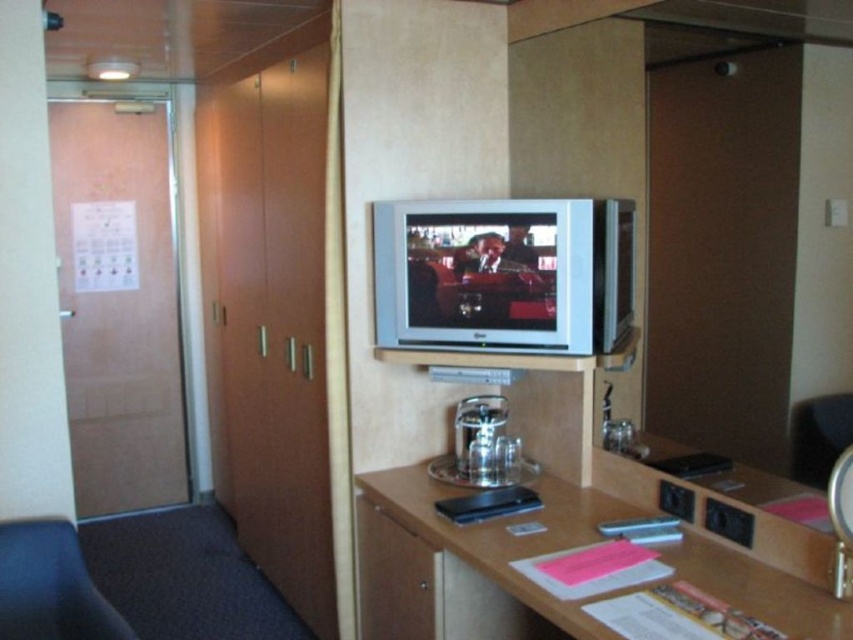
Question: Does silver metallic flat screen tv at center appear on the right side of black leather swivel chair at lower left?

Choices:
 (A) no
 (B) yes

Answer: (B)

Question: Among these objects, which one is farthest from the camera?

Choices:
 (A) matte wood drawer at center
 (B) black leather swivel chair at lower left

Answer: (A)

Question: Can you confirm if wooden desk at center is bigger than black leather swivel chair at lower left?

Choices:
 (A) no
 (B) yes

Answer: (B)

Question: Is wooden desk at center positioned at the back of silver metallic flat screen tv at center?

Choices:
 (A) no
 (B) yes

Answer: (A)

Question: Which object is the closest to the wooden desk at center?

Choices:
 (A) silver metallic flat screen tv at center
 (B) black leather swivel chair at lower left
 (C) matte wood drawer at center

Answer: (C)

Question: Which point is farther from the camera taking this photo?

Choices:
 (A) (408, 576)
 (B) (404, 292)
 (C) (503, 627)
 (D) (20, 520)

Answer: (B)